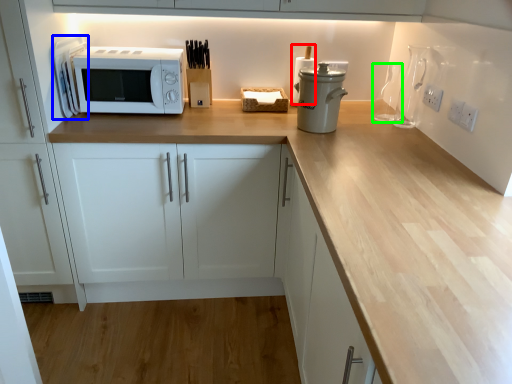
Question: Which object is the closest to the appliance (highlighted by a red box)? Choose among these: appliance (highlighted by a blue box) or bottle (highlighted by a green box).

Choices:
 (A) appliance
 (B) bottle

Answer: (B)